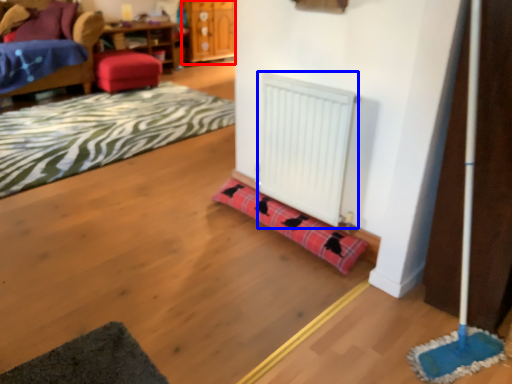
Question: Which point is closer to the camera, dresser (highlighted by a red box) or radiator (highlighted by a blue box)?

Choices:
 (A) dresser
 (B) radiator

Answer: (B)